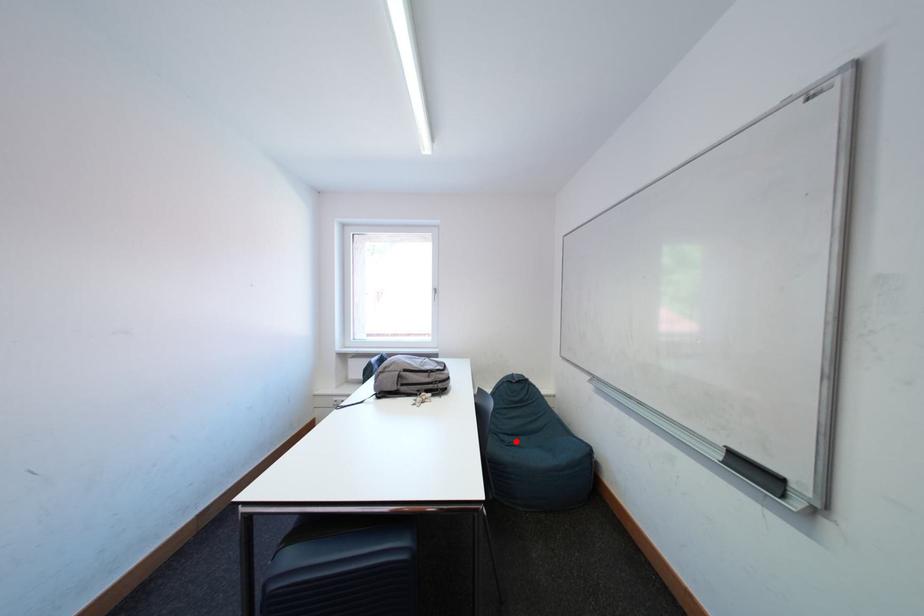
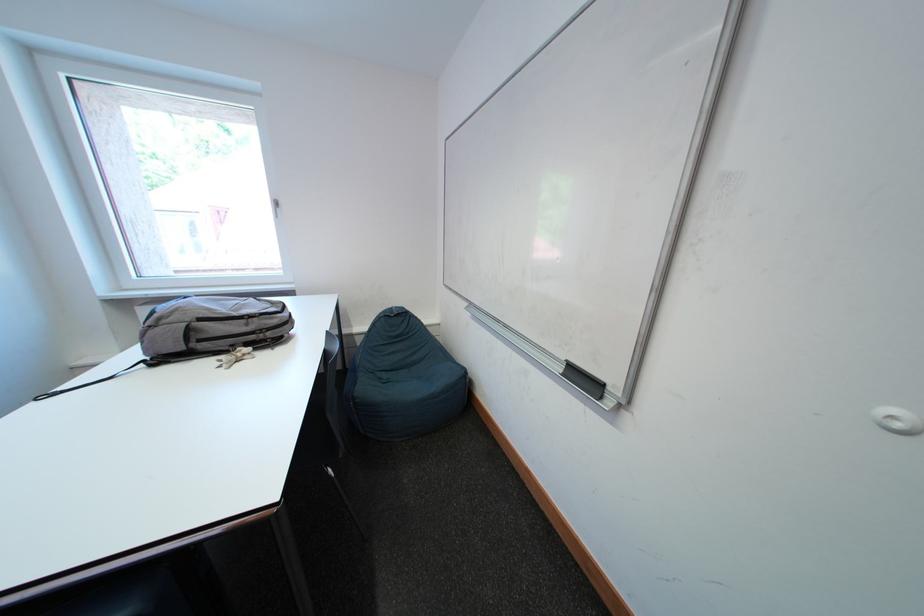
Question: A red point is marked in image1. In image2, is the corresponding 3D point closer to the camera or farther? Reply with the corresponding letter.

Choices:
 (A) The corresponding 3D point is closer.
 (B) The corresponding 3D point is farther.

Answer: (A)